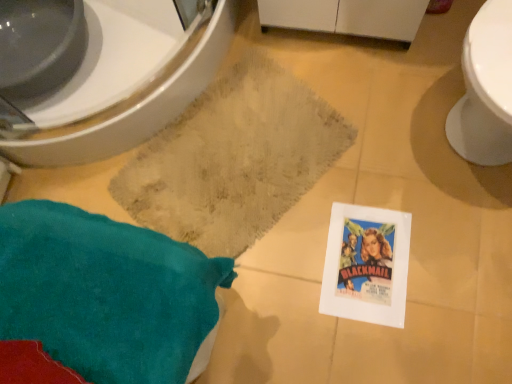
Question: From a real-world perspective, is beige textured bath mat at center positioned over teal fabric throw pillow at lower left based on gravity?

Choices:
 (A) yes
 (B) no

Answer: (B)

Question: Can you confirm if beige textured bath mat at center is wider than teal fabric throw pillow at lower left?

Choices:
 (A) yes
 (B) no

Answer: (A)

Question: Is beige textured bath mat at center to the left of teal fabric throw pillow at lower left from the viewer's perspective?

Choices:
 (A) no
 (B) yes

Answer: (A)

Question: Is beige textured bath mat at center thinner than teal fabric throw pillow at lower left?

Choices:
 (A) no
 (B) yes

Answer: (A)

Question: Is beige textured bath mat at center outside teal fabric throw pillow at lower left?

Choices:
 (A) yes
 (B) no

Answer: (A)

Question: From a real-world perspective, is beige textured bath mat at center physically below teal fabric throw pillow at lower left?

Choices:
 (A) yes
 (B) no

Answer: (A)

Question: Does teal fabric throw pillow at lower left have a larger size compared to white glossy bidet at upper left?

Choices:
 (A) yes
 (B) no

Answer: (B)

Question: Is teal fabric throw pillow at lower left smaller than white glossy bidet at upper left?

Choices:
 (A) yes
 (B) no

Answer: (A)

Question: Is the depth of teal fabric throw pillow at lower left greater than that of white glossy bidet at upper left?

Choices:
 (A) no
 (B) yes

Answer: (A)

Question: Is teal fabric throw pillow at lower left facing towards white glossy bidet at upper left?

Choices:
 (A) no
 (B) yes

Answer: (A)

Question: Considering the relative sizes of teal fabric throw pillow at lower left and white glossy bidet at upper left in the image provided, is teal fabric throw pillow at lower left shorter than white glossy bidet at upper left?

Choices:
 (A) no
 (B) yes

Answer: (A)

Question: Is teal fabric throw pillow at lower left located outside white glossy bidet at upper left?

Choices:
 (A) no
 (B) yes

Answer: (B)

Question: From the image's perspective, is beige textured bath mat at center under white glossy bidet at upper left?

Choices:
 (A) no
 (B) yes

Answer: (B)